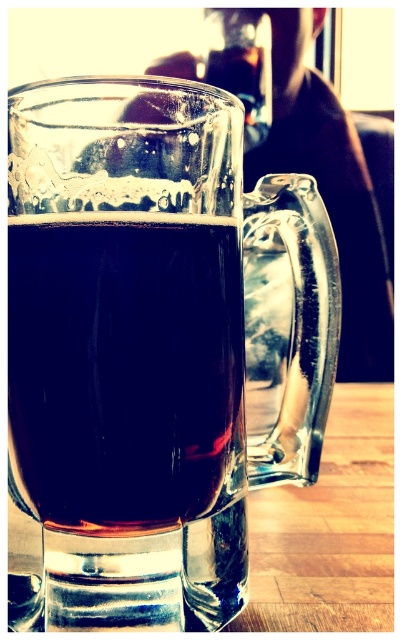
Question: Is transparent glass mug at center wider than transparent glass wine at center?

Choices:
 (A) no
 (B) yes

Answer: (B)

Question: Does transparent glass mug at center lie behind transparent glass wine at center?

Choices:
 (A) no
 (B) yes

Answer: (A)

Question: Is transparent glass mug at center positioned at the back of transparent glass wine at center?

Choices:
 (A) no
 (B) yes

Answer: (A)